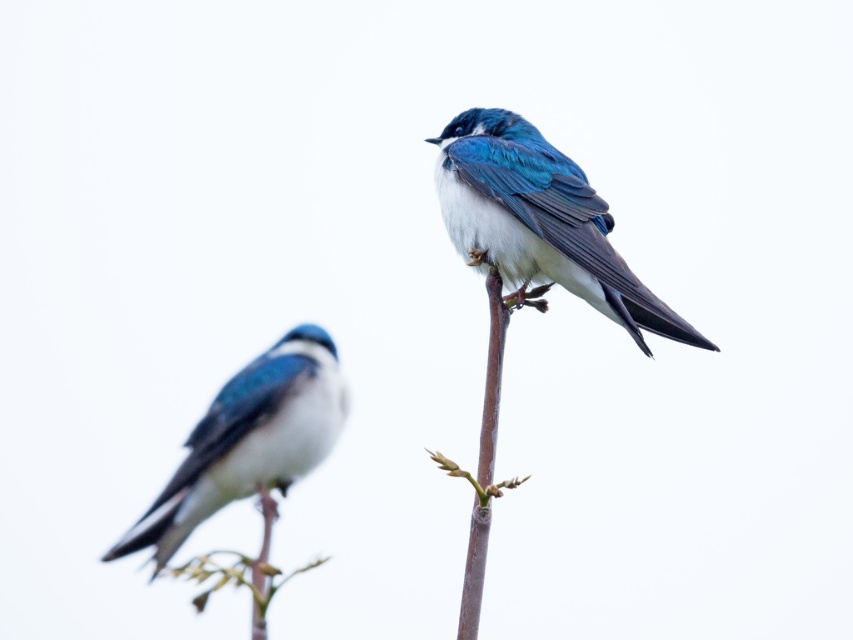
You are a photographer aiming to capture a closeup of the shiny blue bird at center. Based on its position coordinates, where should you aim your camera?

The shiny blue bird at center is located at coordinates point [538,221], so you should aim your camera at that position to capture a closeup.